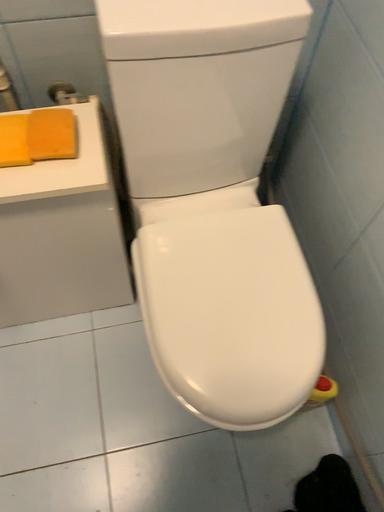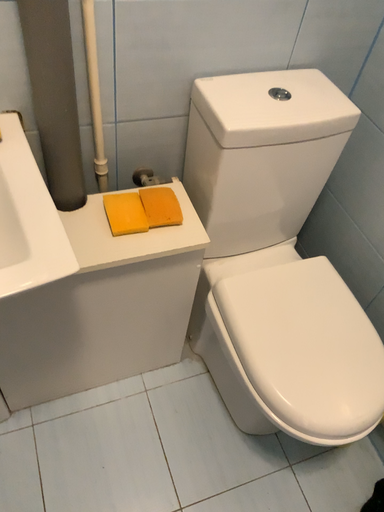
Question: Which way did the camera rotate in the video?

Choices:
 (A) rotated left
 (B) rotated right

Answer: (B)